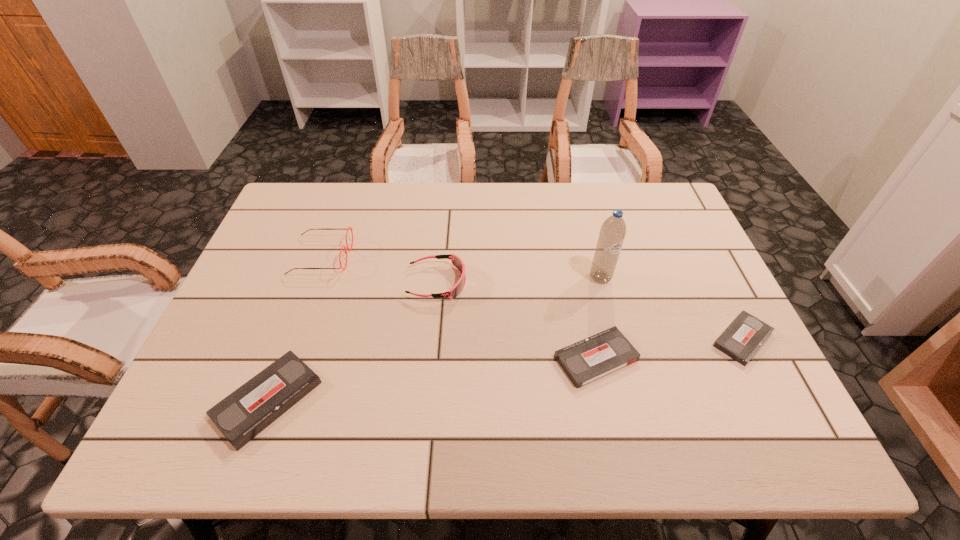
Where is `the leftmost videotape`? the leftmost videotape is located at coordinates (246, 412).

You are a GUI agent. You are given a task and a screenshot of the screen. Output one action in this format:
    pyautogui.click(x=<x>, y=<y>)
    Task: Click on the second tallest videotape
    The height and width of the screenshot is (540, 960).
    Given the screenshot: What is the action you would take?
    pyautogui.click(x=592, y=358)

Find the location of `the second videotape from right to left`. the second videotape from right to left is located at coordinates (592, 358).

Identify the location of the rightmost object. The width and height of the screenshot is (960, 540). (745, 335).

Find the location of a particular element. the shortest object is located at coordinates click(x=745, y=335).

This screenshot has height=540, width=960. In order to click on the fifth shortest object in this screenshot , I will do [x=351, y=229].

Identify the location of the third object from left to right. This screenshot has height=540, width=960. (457, 261).

Locate an element on the screen. the fourth shortest object is located at coordinates (457, 261).

Identify the location of water bottle. (611, 237).

The height and width of the screenshot is (540, 960). Identify the location of blank space located on the back of the leftmost videotape. (299, 316).